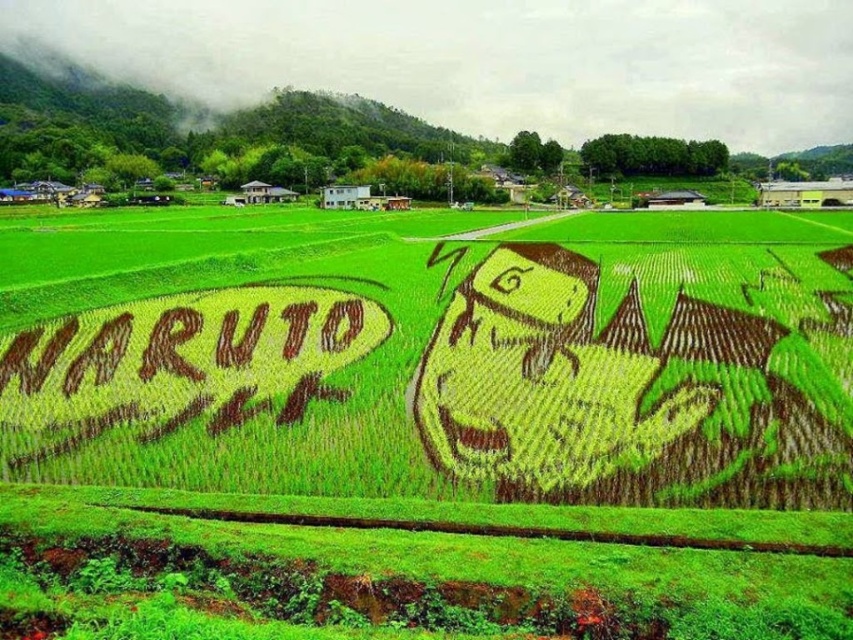
You are standing at the center of the rice paddy field and see the point marked at coordinates (x=426, y=422). What is located at that point?

The point at coordinates (x=426, y=422) corresponds to green grass at center.

You are a farmer inspecting the rice paddy field. You notice two areas of grass in the field. The first is green grass at center and the second is brown grass at left. Which area is positioned to the right of the other?

The green grass at center is positioned to the right of the brown grass at left.